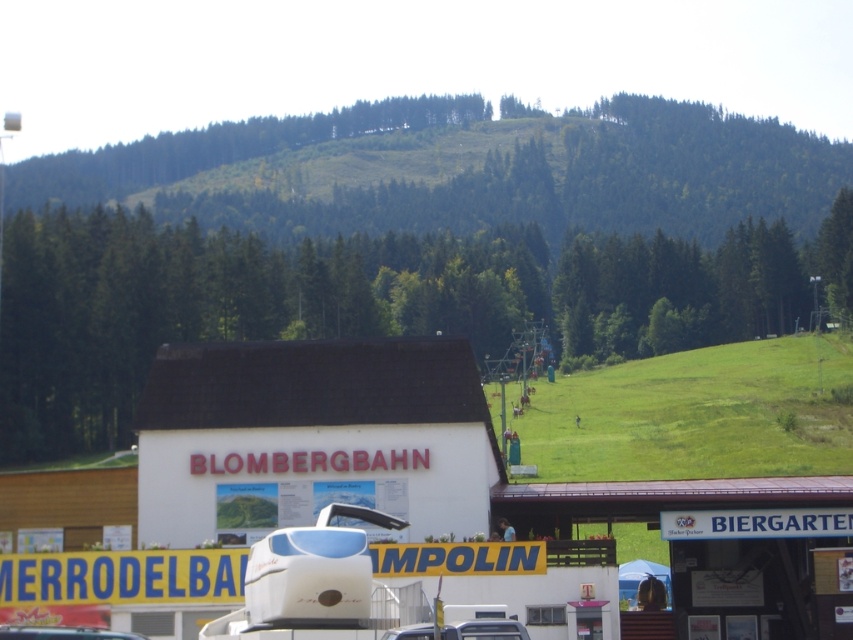
Question: Which object appears closest to the camera in this image?

Choices:
 (A) white glossy car at lower center
 (B) metallic silver car at center
 (C) white wooden building at lower right

Answer: (B)

Question: Estimate the real-world distances between objects in this image. Which object is farther from the white wooden building at lower right?

Choices:
 (A) white glossy car at lower center
 (B) metallic silver car at center

Answer: (B)

Question: Does white wooden building at lower right appear on the left side of white glossy car at lower center?

Choices:
 (A) yes
 (B) no

Answer: (B)

Question: Can you confirm if white wooden building at lower right is smaller than white glossy car at lower center?

Choices:
 (A) no
 (B) yes

Answer: (A)

Question: Is metallic silver car at center wider than white glossy car at lower center?

Choices:
 (A) no
 (B) yes

Answer: (A)

Question: Which object appears farthest from the camera in this image?

Choices:
 (A) white wooden building at lower right
 (B) white glossy car at lower center
 (C) metallic silver car at center

Answer: (A)